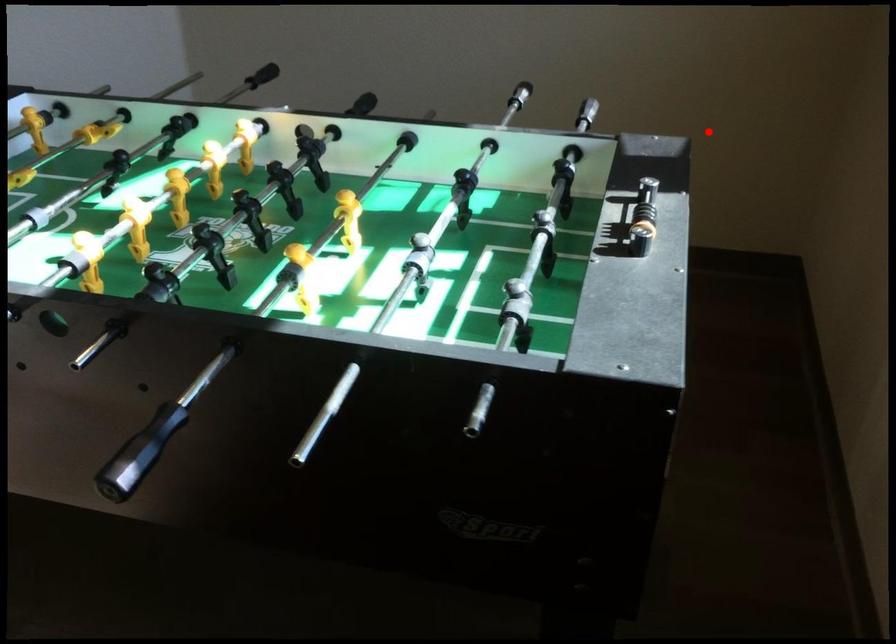
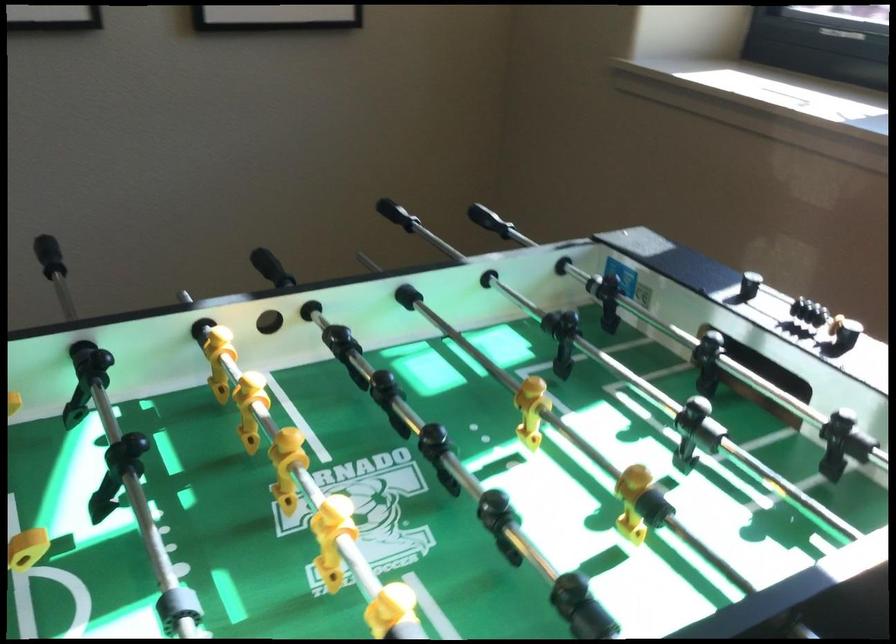
The point at the highlighted location is marked in the first image. Where is the corresponding point in the second image?

(397, 214)